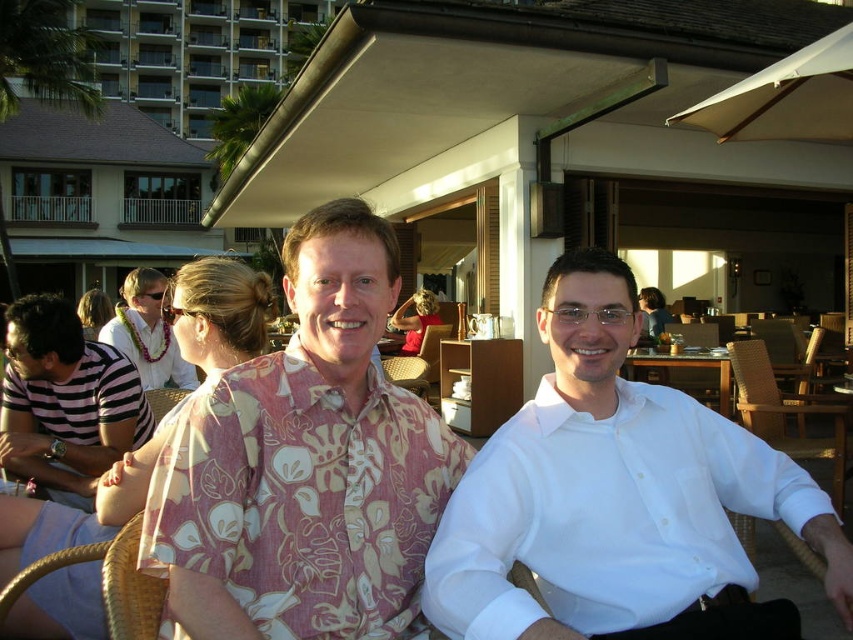
You are a photographer adjusting your camera settings. You notice the printed fabric shirt at center and the leather sunglasses at upper center in your frame. Which object should you focus on first if you want to capture both in focus, considering their heights?

The printed fabric shirt at center is not as tall as the leather sunglasses at upper center, so you should focus on the leather sunglasses at upper center first since it is taller and might require adjusting the focus to ensure both are in frame properly.

You are standing at the point marked as point (618, 497) in the image. What object is located exactly at that point?

The white smooth shirt at center is located exactly at point (618, 497).

From the picture: You are a photographer adjusting camera settings to capture the two people in the scene. The white smooth shirt at center and the floral fabric shirt at left are both in focus. Which person is shorter?

The white smooth shirt at center is not as tall as floral fabric shirt at left, so the person wearing the white smooth shirt at center is shorter.